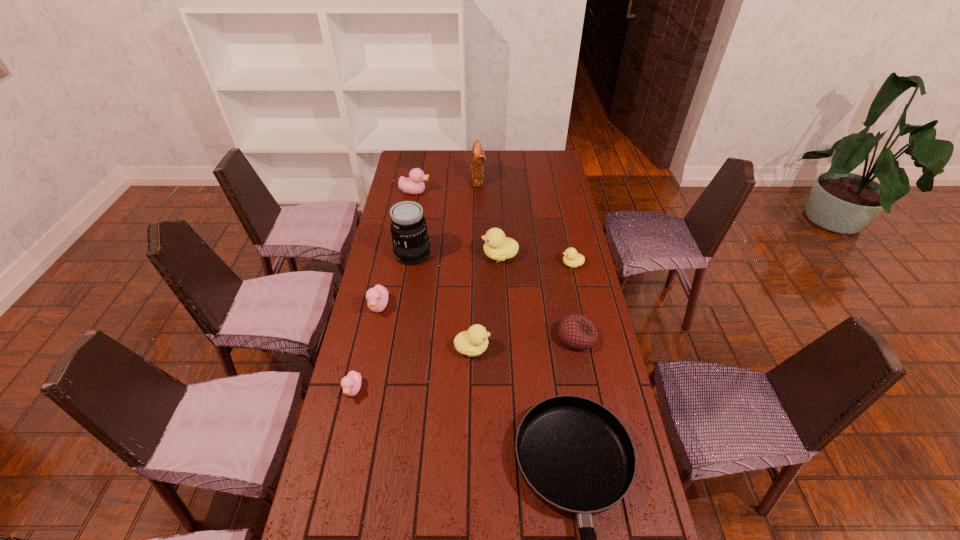
I want to click on the second closest pink duckling to the telephoto lens, so click(414, 184).

Locate an element on the screen. free region that satisfies the following two spatial constraints: 1. on the open side of the clutch bag; 2. on the front-facing side of the nearest duckling is located at coordinates (477, 390).